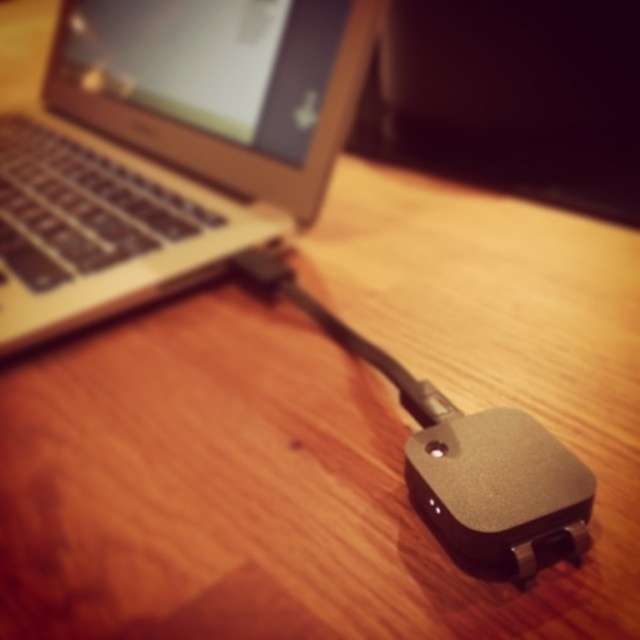
Question: Can you confirm if satin gold laptop at upper left is wider than satin black mouse at lower right?

Choices:
 (A) no
 (B) yes

Answer: (B)

Question: Does satin gold laptop at upper left have a greater width compared to satin black mouse at lower right?

Choices:
 (A) yes
 (B) no

Answer: (A)

Question: Which point appears closest to the camera in this image?

Choices:
 (A) (504, 502)
 (B) (72, 186)

Answer: (A)

Question: Is satin gold laptop at upper left smaller than satin black mouse at lower right?

Choices:
 (A) no
 (B) yes

Answer: (A)

Question: Which point is closer to the camera?

Choices:
 (A) satin black mouse at lower right
 (B) satin gold laptop at upper left

Answer: (A)